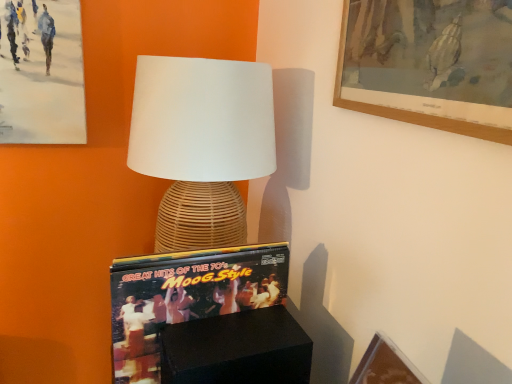
Question: Can you confirm if matte vinyl record at center is shorter than woven rattan lamp at center?

Choices:
 (A) no
 (B) yes

Answer: (B)

Question: Can you confirm if matte vinyl record at center is thinner than woven rattan lamp at center?

Choices:
 (A) no
 (B) yes

Answer: (A)

Question: Does matte vinyl record at center come behind woven rattan lamp at center?

Choices:
 (A) no
 (B) yes

Answer: (A)

Question: Does matte vinyl record at center have a smaller size compared to woven rattan lamp at center?

Choices:
 (A) yes
 (B) no

Answer: (A)

Question: From a real-world perspective, does matte vinyl record at center stand above woven rattan lamp at center?

Choices:
 (A) yes
 (B) no

Answer: (B)

Question: Is matte vinyl record at center not close to woven rattan lamp at center?

Choices:
 (A) yes
 (B) no

Answer: (B)

Question: Is black matte box at lower center to the left of woven rattan lamp at center from the viewer's perspective?

Choices:
 (A) no
 (B) yes

Answer: (A)

Question: Is black matte box at lower center looking in the opposite direction of woven rattan lamp at center?

Choices:
 (A) no
 (B) yes

Answer: (A)

Question: Is black matte box at lower center aimed at woven rattan lamp at center?

Choices:
 (A) no
 (B) yes

Answer: (A)

Question: From a real-world perspective, does black matte box at lower center sit lower than woven rattan lamp at center?

Choices:
 (A) no
 (B) yes

Answer: (B)

Question: Is woven rattan lamp at center a part of black matte box at lower center?

Choices:
 (A) no
 (B) yes

Answer: (A)

Question: Is black matte box at lower center positioned behind woven rattan lamp at center?

Choices:
 (A) yes
 (B) no

Answer: (B)

Question: Is matte vinyl record at center facing away from black matte box at lower center?

Choices:
 (A) yes
 (B) no

Answer: (B)